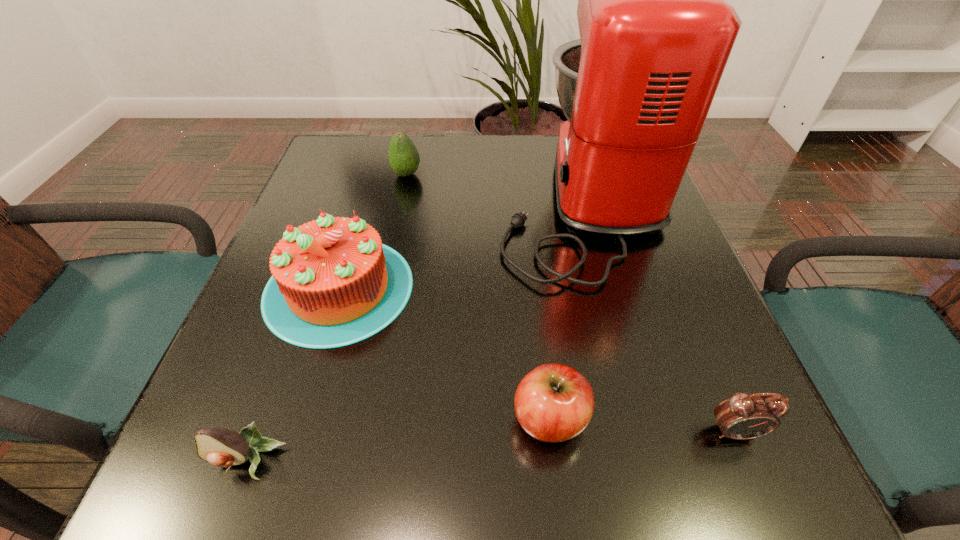
Where is `free location located 0.110m on the front of the right avocado`? This screenshot has height=540, width=960. free location located 0.110m on the front of the right avocado is located at coordinates (398, 212).

Image resolution: width=960 pixels, height=540 pixels. Find the location of `vacant space located on the left of the apple`. vacant space located on the left of the apple is located at coordinates (386, 418).

Locate an element on the screen. This screenshot has width=960, height=540. free space located 0.050m on the face of the alarm clock is located at coordinates (755, 481).

In order to click on kitchen mixer situated at the far edge in this screenshot , I will do `click(655, 32)`.

At what (x,y) coordinates should I click in order to perform the action: click on avocado that is at the far edge. Please return your answer as a coordinate pair (x, y). Looking at the image, I should click on (403, 155).

Identify the location of apple that is at the near edge. The image size is (960, 540). (553, 403).

At what (x,y) coordinates should I click in order to perform the action: click on alarm clock that is at the near edge. Please return your answer as a coordinate pair (x, y). The width and height of the screenshot is (960, 540). Looking at the image, I should click on (743, 416).

You are a GUI agent. You are given a task and a screenshot of the screen. Output one action in this format:
    pyautogui.click(x=<x>, y=<y>)
    Task: Click on the avocado that is at the near edge
    This screenshot has width=960, height=540.
    Given the screenshot: What is the action you would take?
    pyautogui.click(x=220, y=447)

I want to click on cake positioned at the left edge, so click(333, 284).

Where is `avocado positioned at the left edge`? The height and width of the screenshot is (540, 960). avocado positioned at the left edge is located at coordinates (220, 447).